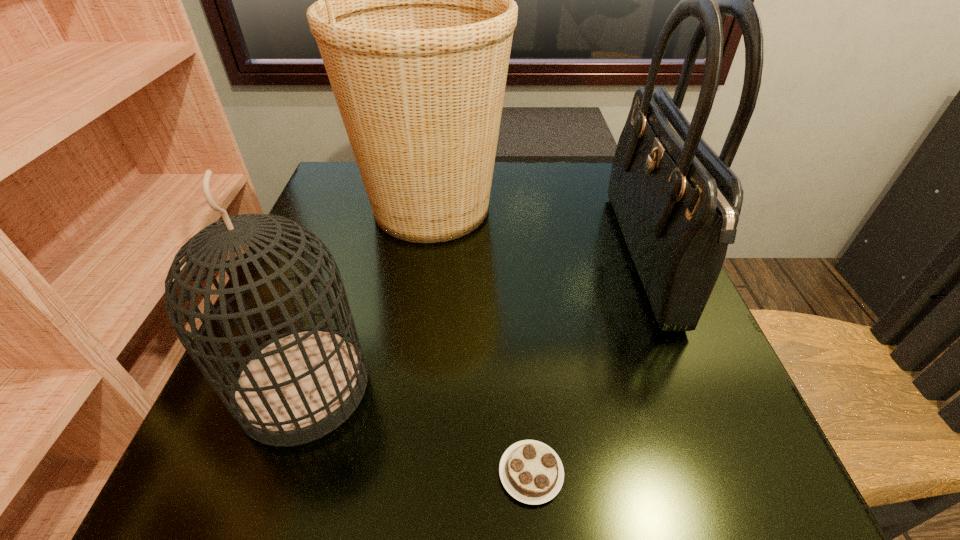
I want to click on vacant position at the far edge of the desktop, so click(556, 198).

Locate an element on the screen. This screenshot has width=960, height=540. vacant space at the near edge of the desktop is located at coordinates (346, 489).

Find the location of a particular element. vacant space at the left edge is located at coordinates (349, 272).

The height and width of the screenshot is (540, 960). I want to click on free space at the right edge of the desktop, so click(702, 331).

You are a GUI agent. You are given a task and a screenshot of the screen. Output one action in this format:
    pyautogui.click(x=<x>, y=<y>)
    Task: Click on the vacant space at the far left corner of the desktop
    The image size is (960, 540).
    Given the screenshot: What is the action you would take?
    pyautogui.click(x=331, y=176)

Identify the location of blank space at the near left corner of the desktop. (266, 476).

Find the location of a particular element. free space between the basket and the chocolate cake is located at coordinates (481, 340).

I want to click on vacant space that is in between the third tallest object and the chocolate cake, so click(418, 430).

Where is `free spot between the rightmost object and the basket`? free spot between the rightmost object and the basket is located at coordinates (537, 233).

The image size is (960, 540). Find the location of `free space between the shortest object and the rightmost object`. free space between the shortest object and the rightmost object is located at coordinates (587, 366).